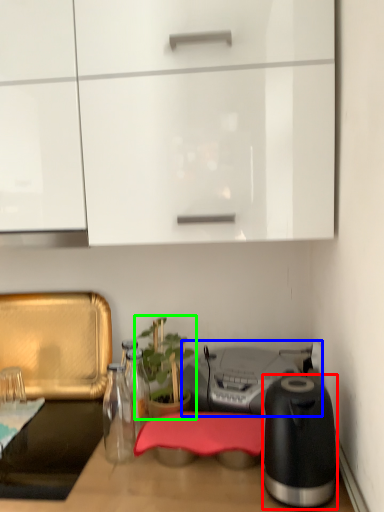
Question: Which object is positioned closest to kitchen appliance (highlighted by a red box)? Select from appliance (highlighted by a blue box) and houseplant (highlighted by a green box).

Choices:
 (A) appliance
 (B) houseplant

Answer: (A)